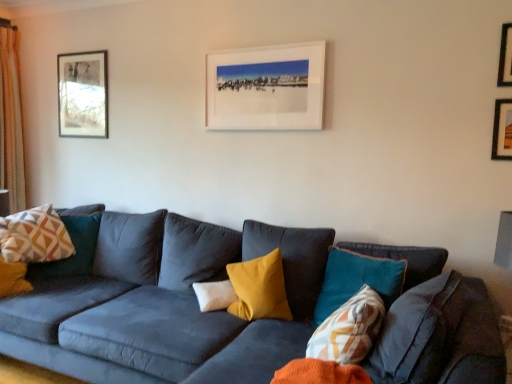
Question: Is light beige textured curtain at left positioned far away from geometric-patterned fabric pillow at left, the 3th pillow from the right?

Choices:
 (A) no
 (B) yes

Answer: (A)

Question: From a real-world perspective, is light beige textured curtain at left under geometric-patterned fabric pillow at left, the 3th pillow from the right?

Choices:
 (A) yes
 (B) no

Answer: (B)

Question: From a real-world perspective, is light beige textured curtain at left on top of geometric-patterned fabric pillow at left, the first pillow viewed from the back?

Choices:
 (A) no
 (B) yes

Answer: (B)

Question: Can you confirm if light beige textured curtain at left is smaller than geometric-patterned fabric pillow at left, placed as the 1th pillow when sorted from left to right?

Choices:
 (A) no
 (B) yes

Answer: (A)

Question: From the image's perspective, is light beige textured curtain at left on top of geometric-patterned fabric pillow at left, the first pillow viewed from the back?

Choices:
 (A) no
 (B) yes

Answer: (B)

Question: Does point (503, 152) appear closer or farther from the camera than point (207, 289)?

Choices:
 (A) farther
 (B) closer

Answer: (B)

Question: From a real-world perspective, is wooden picture frame at upper right, which is the third picture frame from back to front, positioned above or below white soft pillow at center, arranged as the second pillow when viewed from the right?

Choices:
 (A) above
 (B) below

Answer: (A)

Question: Considering the positions of wooden picture frame at upper right, which ranks as the 2th picture frame in front-to-back order, and white soft pillow at center, the second pillow when ordered from front to back, in the image, is wooden picture frame at upper right, which ranks as the 2th picture frame in front-to-back order, wider or thinner than white soft pillow at center, the second pillow when ordered from front to back,?

Choices:
 (A) wide
 (B) thin

Answer: (B)

Question: Is wooden picture frame at upper right, which ranks as the 2th picture frame in front-to-back order, inside the boundaries of white soft pillow at center, arranged as the second pillow when viewed from the right, or outside?

Choices:
 (A) inside
 (B) outside

Answer: (B)

Question: Is wooden picture frame at upper right, which ranks as the second picture frame in right-to-left order, situated inside light beige textured curtain at left or outside?

Choices:
 (A) inside
 (B) outside

Answer: (B)

Question: Is point (492, 155) closer or farther from the camera than point (10, 140)?

Choices:
 (A) farther
 (B) closer

Answer: (B)

Question: From the image's perspective, relative to light beige textured curtain at left, is wooden picture frame at upper right, arranged as the third picture frame when viewed from the left, above or below?

Choices:
 (A) below
 (B) above

Answer: (A)

Question: Would you say wooden picture frame at upper right, which is the third picture frame from back to front, is to the left or to the right of light beige textured curtain at left in the picture?

Choices:
 (A) right
 (B) left

Answer: (A)

Question: Is metallic gold picture frame at upper right, which appears as the first picture frame when viewed from the right, taller or shorter than wooden framed picture at upper left, which appears as the 1th picture frame when viewed from the back?

Choices:
 (A) tall
 (B) short

Answer: (B)

Question: Looking at their shapes, would you say metallic gold picture frame at upper right, which is the fourth picture frame from back to front, is wider or thinner than wooden framed picture at upper left, which appears as the 1th picture frame when viewed from the back?

Choices:
 (A) wide
 (B) thin

Answer: (B)